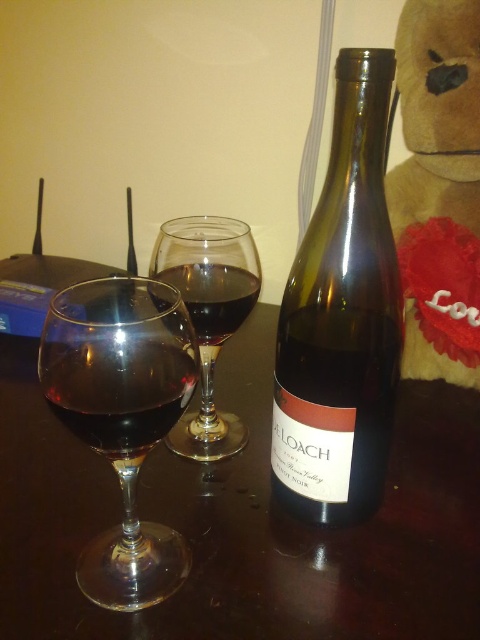
Image resolution: width=480 pixels, height=640 pixels. What do you see at coordinates (243, 522) in the screenshot?
I see `dark brown wood table at center` at bounding box center [243, 522].

Can you confirm if dark brown wood table at center is positioned below shiny dark glass at center?

Correct, dark brown wood table at center is located below shiny dark glass at center.

The height and width of the screenshot is (640, 480). I want to click on dark brown wood table at center, so click(x=243, y=522).

Is point (467, 253) behind point (192, 323)?

Yes, point (467, 253) is farther from viewer.

Which is behind, point (458, 330) or point (238, 301)?

Positioned behind is point (458, 330).

Where is `brown plush toy at upper right`? Image resolution: width=480 pixels, height=640 pixels. brown plush toy at upper right is located at coordinates (439, 188).

Between dark brown wood table at center and transparent glass at center, which one appears on the right side from the viewer's perspective?

From the viewer's perspective, dark brown wood table at center appears more on the right side.

Is dark brown wood table at center below transparent glass at center?

Indeed, dark brown wood table at center is positioned under transparent glass at center.

Is point (232, 340) less distant than point (204, 429)?

No.

Where is `dark brown wood table at center`? dark brown wood table at center is located at coordinates (243, 522).